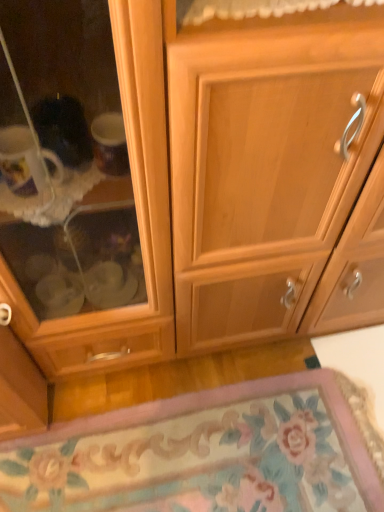
In order to click on free spot above floral carpet at lower center (from a real-world perspective) in this screenshot , I will do `click(220, 453)`.